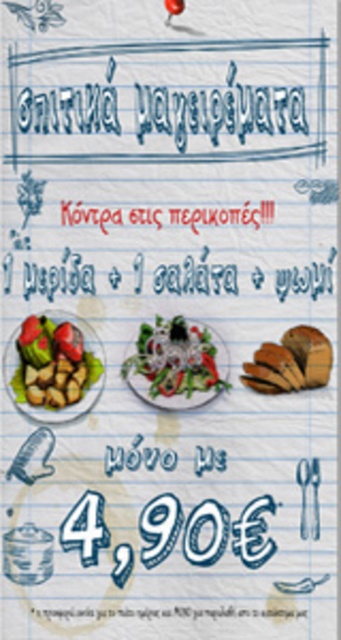
Does green leafy salad at center come in front of red matte tomato at center?

No, green leafy salad at center is further to the viewer.

Which is more to the right, green leafy salad at center or red matte tomato at center?

From the viewer's perspective, green leafy salad at center appears more on the right side.

Who is more distant from viewer, (200, 364) or (184, 8)?

Point (200, 364)

Find the location of a particular element. This screenshot has width=341, height=640. green leafy salad at center is located at coordinates (176, 358).

Between point (200, 365) and point (300, 374), which one is positioned behind?

The point (200, 365) is behind.

Who is more distant from viewer, (x=212, y=344) or (x=297, y=365)?

The point (x=212, y=344) is more distant.

The width and height of the screenshot is (341, 640). What are the coordinates of `green leafy salad at center` in the screenshot? It's located at (176, 358).

In the scene shown: Can you confirm if brown matte/rough potatoes at left is positioned to the right of red matte tomato at center?

Incorrect, brown matte/rough potatoes at left is not on the right side of red matte tomato at center.

Can you confirm if brown matte/rough potatoes at left is positioned to the left of red matte tomato at center?

Correct, you'll find brown matte/rough potatoes at left to the left of red matte tomato at center.

Which is behind, point (33, 358) or point (180, 1)?

The point (33, 358) is behind.

The width and height of the screenshot is (341, 640). I want to click on brown matte/rough potatoes at left, so click(x=53, y=364).